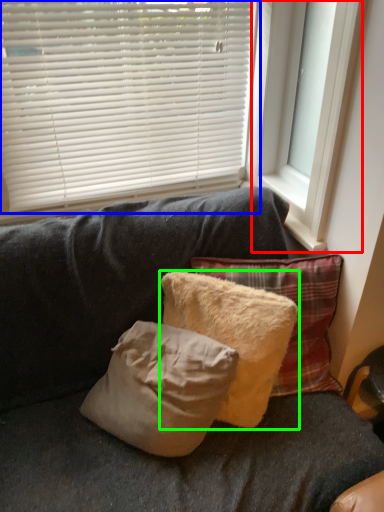
Question: Based on their relative distances, which object is farther from window frame (highlighted by a red box)? Choose from window blind (highlighted by a blue box) and pillow (highlighted by a green box).

Choices:
 (A) window blind
 (B) pillow

Answer: (B)